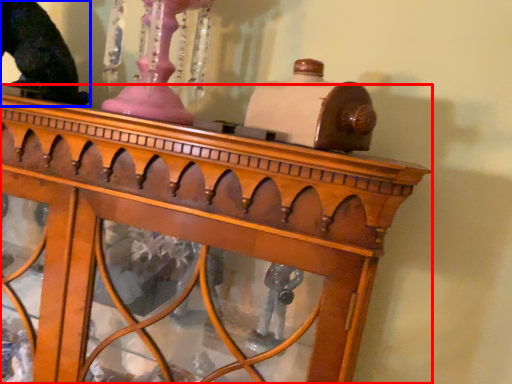
Question: Which of the following is the closest to the observer, furniture (highlighted by a red box) or animal (highlighted by a blue box)?

Choices:
 (A) furniture
 (B) animal

Answer: (A)